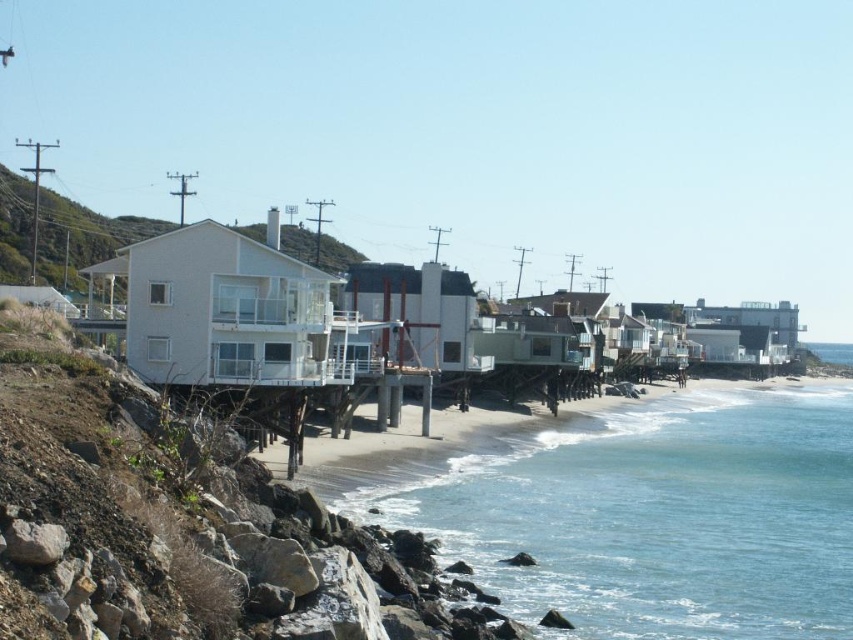
Question: Which point appears farthest from the camera in this image?

Choices:
 (A) (28, 216)
 (B) (589, 436)

Answer: (A)

Question: Does clear blue water at lower right have a smaller size compared to white matte house at center?

Choices:
 (A) no
 (B) yes

Answer: (B)

Question: Is clear blue water at lower right below white matte house at center?

Choices:
 (A) yes
 (B) no

Answer: (A)

Question: Does clear blue water at lower right lie behind white matte house at center?

Choices:
 (A) yes
 (B) no

Answer: (B)